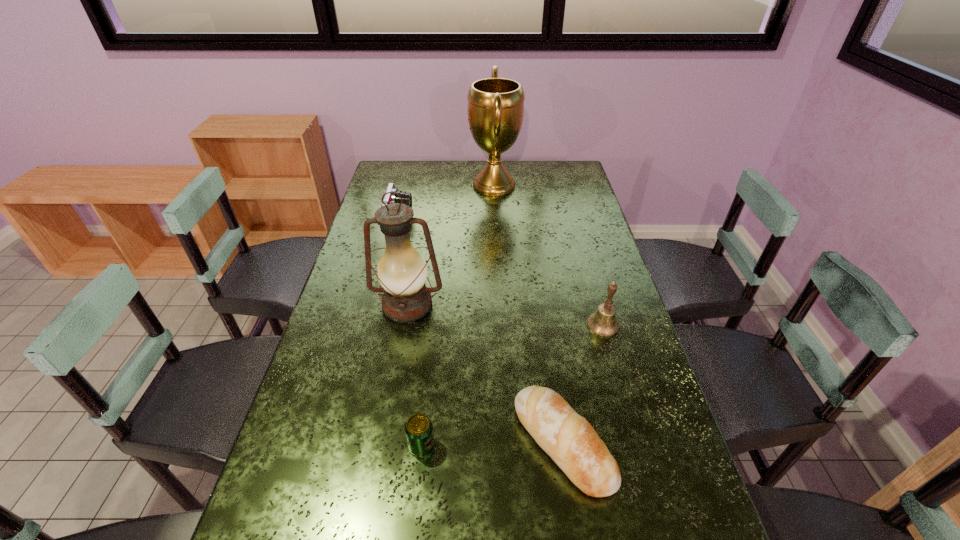
Locate an element on the screen. trophy cup is located at coordinates (495, 109).

Find the location of a particular element. This screenshot has height=540, width=960. oil lamp is located at coordinates (402, 272).

This screenshot has width=960, height=540. I want to click on bell, so click(x=603, y=323).

The image size is (960, 540). Identify the location of the rightmost object. [603, 323].

Find the location of a particular element. This screenshot has height=540, width=960. the fourth tallest object is located at coordinates (391, 198).

Where is `bread`? The image size is (960, 540). bread is located at coordinates point(568,438).

Find the location of a particular element. beer can is located at coordinates (419, 431).

You are a GUI agent. You are given a task and a screenshot of the screen. Output one action in this format:
    pyautogui.click(x=<x>, y=<y>)
    Task: Click on the free space located 0.170m on the surface of the trophy cup with symbols
    This screenshot has height=540, width=960.
    Given the screenshot: What is the action you would take?
    pyautogui.click(x=429, y=186)

This screenshot has height=540, width=960. In order to click on free space located on the surface of the trophy cup with symbols in this screenshot , I will do `click(429, 186)`.

Locate an element on the screen. vacant space located on the surface of the trophy cup with symbols is located at coordinates (380, 186).